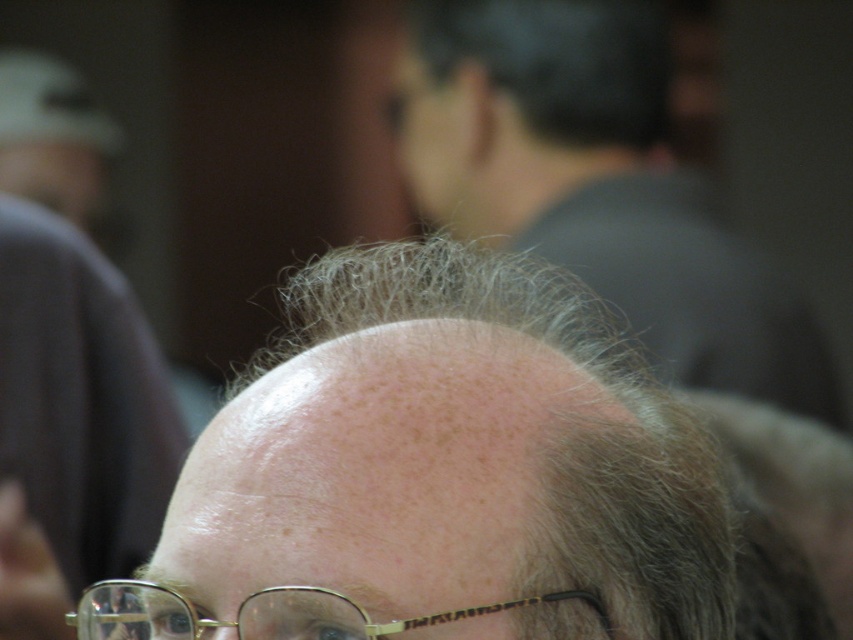
Who is more forward, (474, 49) or (135, 598)?

Positioned in front is point (135, 598).

Can you confirm if smooth skin head at center is taller than gold-framed glasses at center?

Correct, smooth skin head at center is much taller as gold-framed glasses at center.

Does point (643, 273) come in front of point (281, 600)?

No, it is not.

At what (x,y) coordinates should I click in order to perform the action: click on smooth skin head at center. Please return your answer as a coordinate pair (x, y). The width and height of the screenshot is (853, 640). Looking at the image, I should click on (596, 186).

Is point (408, 305) farther from camera compared to point (3, 435)?

No, (408, 305) is closer to viewer.

The image size is (853, 640). Identify the location of gray matte hair at center. (556, 440).

Find the location of `gray matte hair at center`. gray matte hair at center is located at coordinates (556, 440).

Does gray matte hair at center have a smaller size compared to gold-framed glasses at center?

No, gray matte hair at center is not smaller than gold-framed glasses at center.

At what (x,y) coordinates should I click in order to perform the action: click on gray matte hair at center. Please return your answer as a coordinate pair (x, y). Looking at the image, I should click on (556, 440).